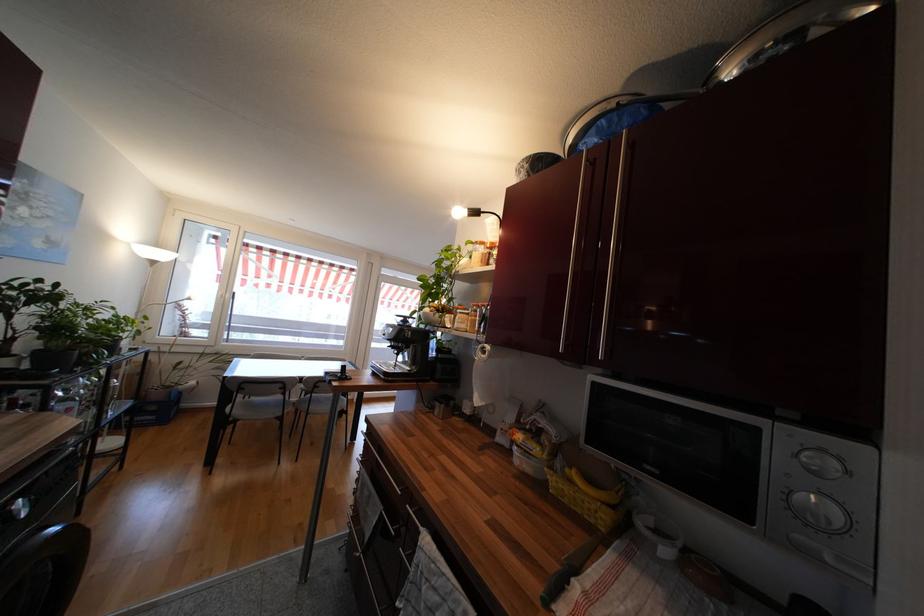
What do you see at coordinates (431, 583) in the screenshot? The height and width of the screenshot is (616, 924). I see `the black knife handle` at bounding box center [431, 583].